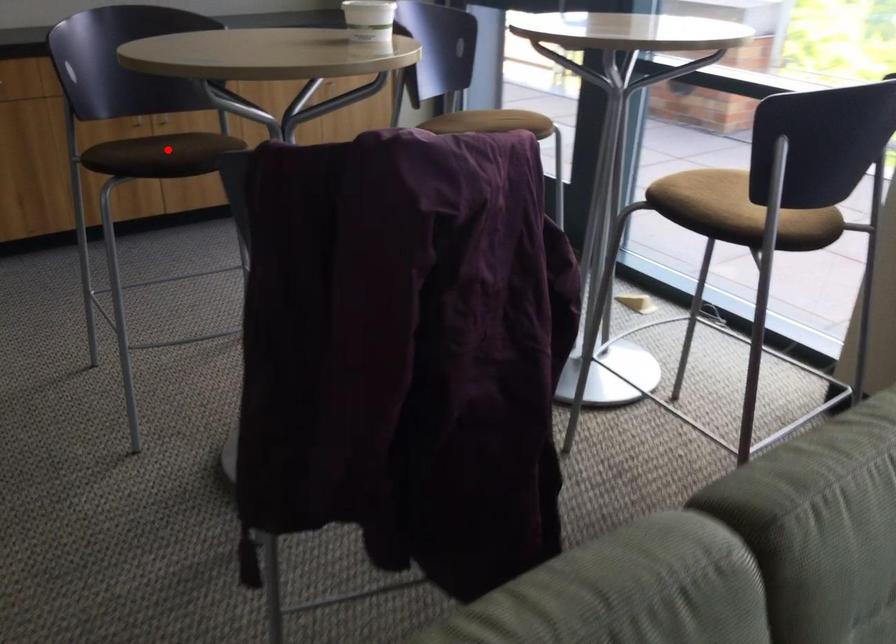
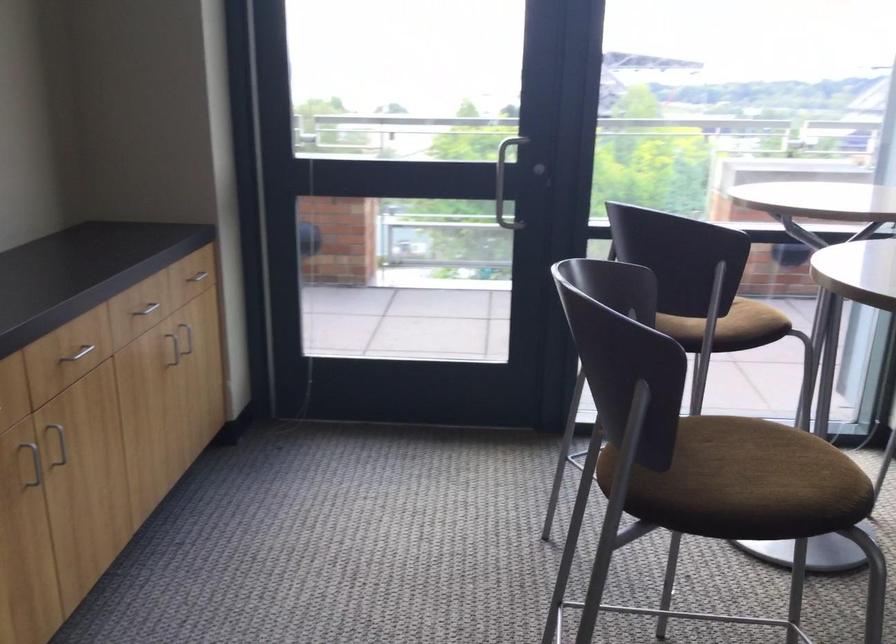
In the second image, find the point that corresponds to the highlighted location in the first image.

(739, 482)